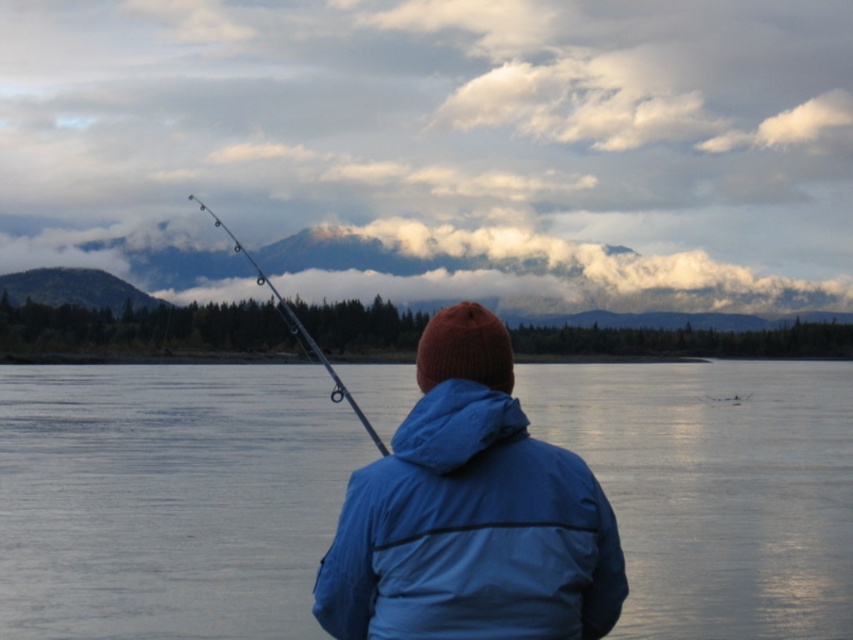
Measure the distance from smooth water at center to metallic rod at upper center.

They are 30.62 meters apart.

In the scene shown: Is smooth water at center thinner than metallic rod at upper center?

Incorrect, smooth water at center's width is not less than metallic rod at upper center's.

Is point (724, 593) positioned in front of point (369, 426)?

No.

Where is `smooth water at center`? smooth water at center is located at coordinates (167, 499).

Is smooth water at center to the left of blue fabric jacket at center from the viewer's perspective?

Incorrect, smooth water at center is not on the left side of blue fabric jacket at center.

Between smooth water at center and blue fabric jacket at center, which one has less height?

blue fabric jacket at center is shorter.

This screenshot has height=640, width=853. In order to click on smooth water at center in this screenshot , I will do `click(167, 499)`.

Which is above, blue fabric jacket at center or metallic rod at upper center?

metallic rod at upper center is above.

Is blue fabric jacket at center shorter than metallic rod at upper center?

Indeed, blue fabric jacket at center has a lesser height compared to metallic rod at upper center.

The width and height of the screenshot is (853, 640). In order to click on blue fabric jacket at center in this screenshot , I will do `click(471, 532)`.